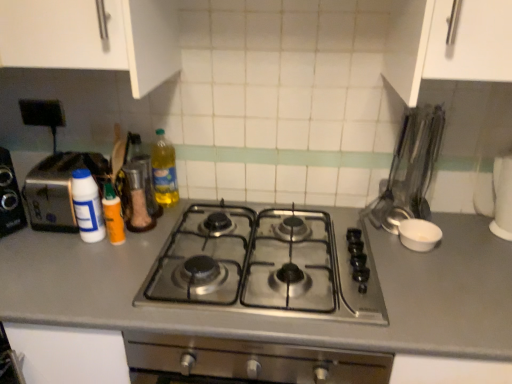
Image resolution: width=512 pixels, height=384 pixels. In order to click on vacant area located to the right-hand side of white plastic bottle at left, placed as the first bottle when sorted from left to right in this screenshot , I will do `click(141, 240)`.